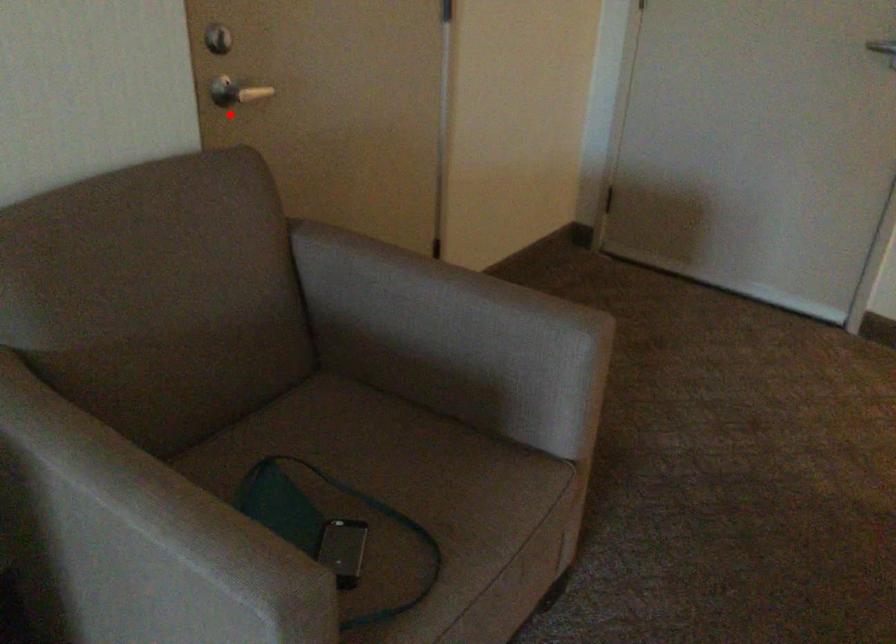
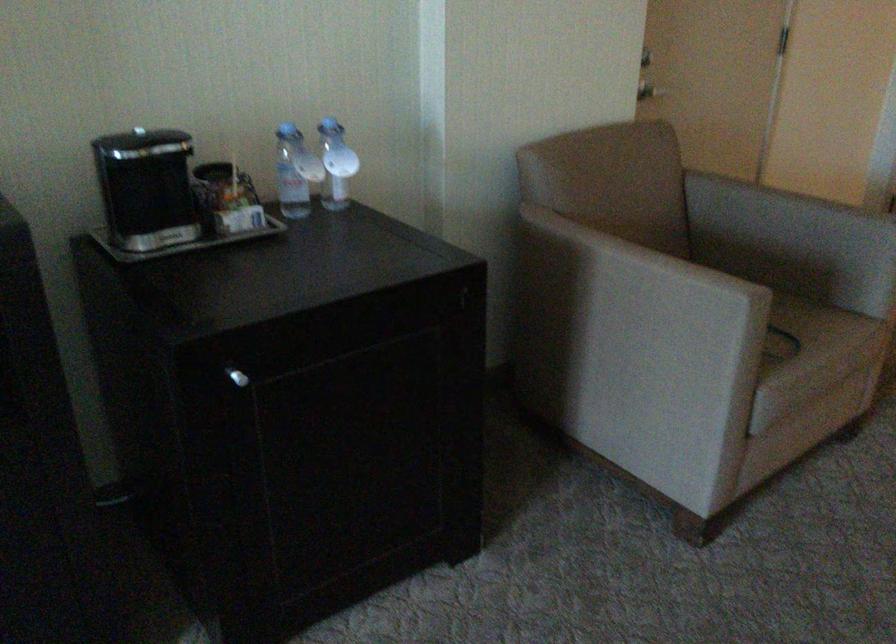
Question: I am providing you with two images of the same scene from different viewpoints. Given a red point in image1, look at the same physical point in image2. Is it:

Choices:
 (A) Closer to the viewpoint
 (B) Farther from the viewpoint

Answer: (B)